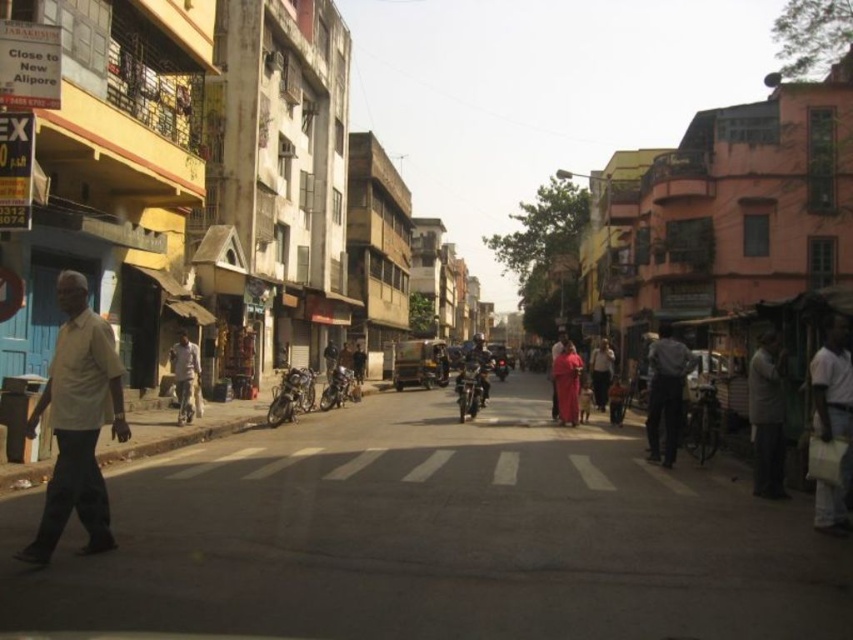
Is the position of dark gray fabric pants at center more distant than that of matte black motorcycle at center?

No, dark gray fabric pants at center is in front of matte black motorcycle at center.

Which is above, dark gray fabric pants at center or matte black motorcycle at center?

Positioned higher is dark gray fabric pants at center.

Identify the location of dark gray fabric pants at center. (665, 394).

I want to click on dark gray fabric pants at center, so click(x=665, y=394).

Can you confirm if light beige shirt at left is taller than shiny metallic motorcycle at center?

Correct, light beige shirt at left is much taller as shiny metallic motorcycle at center.

This screenshot has width=853, height=640. What do you see at coordinates (77, 422) in the screenshot?
I see `light beige shirt at left` at bounding box center [77, 422].

Find the location of a particular element. The width and height of the screenshot is (853, 640). light beige shirt at left is located at coordinates (77, 422).

Find the location of a particular element. The height and width of the screenshot is (640, 853). light beige shirt at left is located at coordinates (77, 422).

Between shiny metallic motorcycle at center and matte black motorcycle at center, which one appears on the right side from the viewer's perspective?

matte black motorcycle at center is more to the right.

Which is above, shiny metallic motorcycle at center or matte black motorcycle at center?

matte black motorcycle at center

You are a GUI agent. You are given a task and a screenshot of the screen. Output one action in this format:
    pyautogui.click(x=<x>, y=<y>)
    Task: Click on the shiny metallic motorcycle at center
    This screenshot has height=640, width=853.
    Given the screenshot: What is the action you would take?
    pyautogui.click(x=471, y=387)

Find the location of a particular element. shiny metallic motorcycle at center is located at coordinates (471, 387).